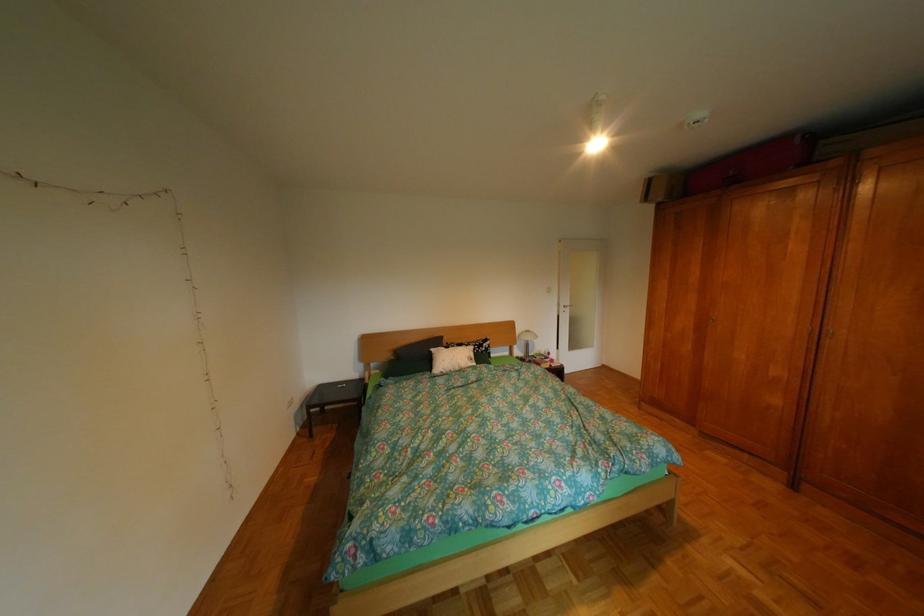
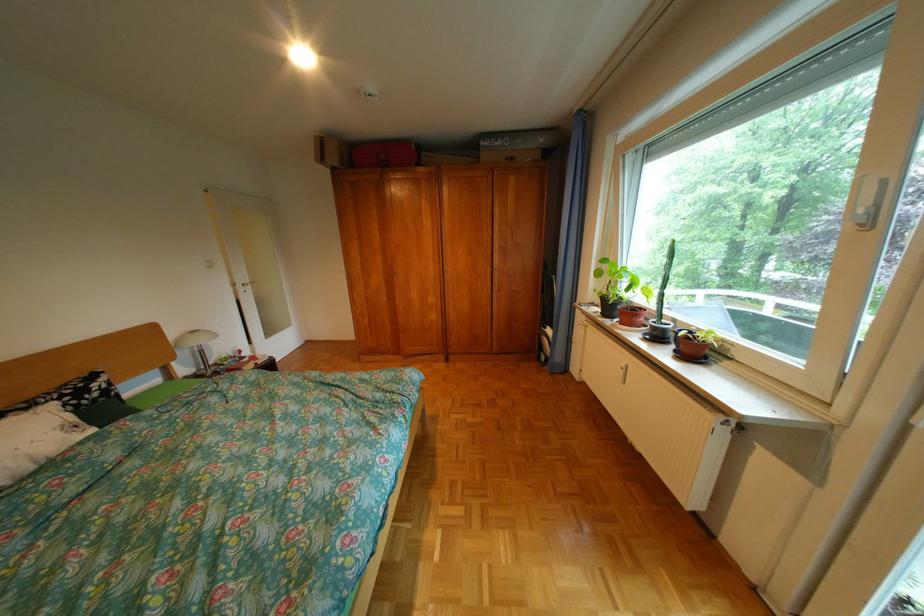
Find the pixel in the second image that matches [699,323] in the first image.

(392, 280)